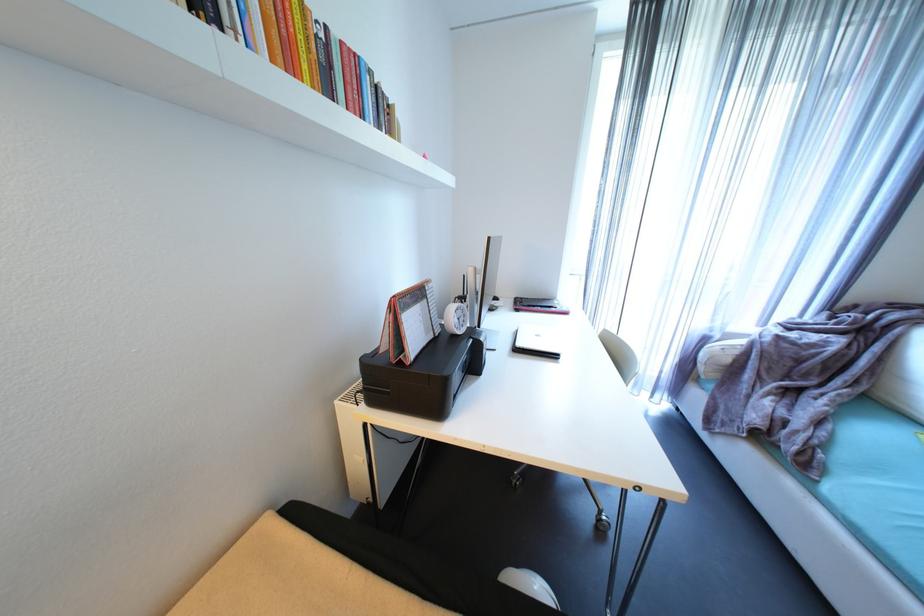
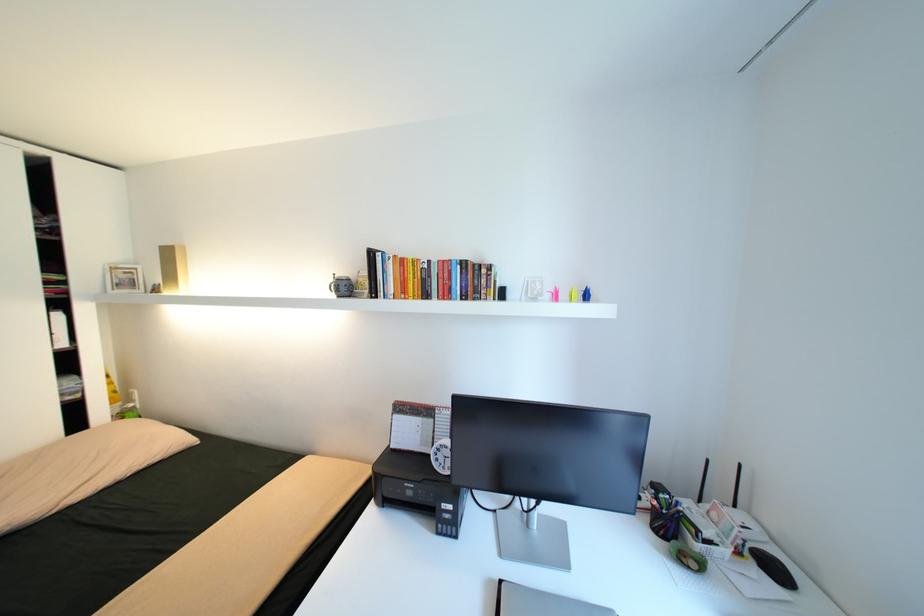
The point at (434,288) is marked in the first image. Where is the corresponding point in the second image?

(444, 411)